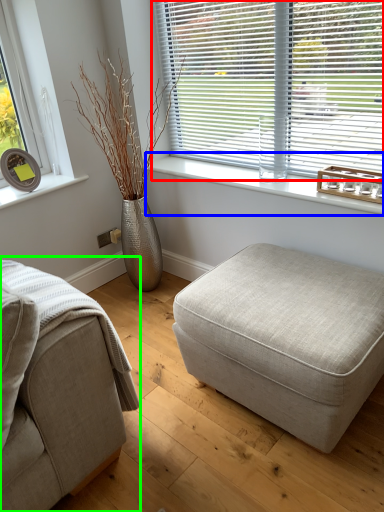
Question: Which is nearer to the window blind (highlighted by a red box)? window sill (highlighted by a blue box) or studio couch (highlighted by a green box).

Choices:
 (A) window sill
 (B) studio couch

Answer: (A)